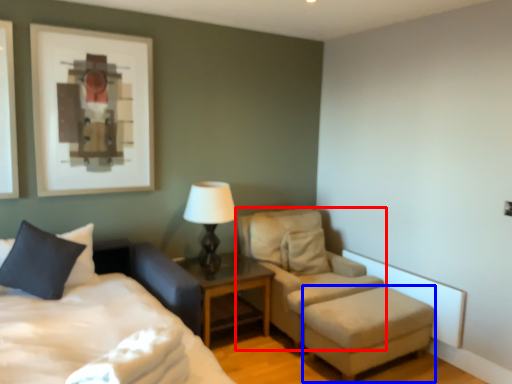
Question: Which point is further to the camera, chair (highlighted by a red box) or stool (highlighted by a blue box)?

Choices:
 (A) chair
 (B) stool

Answer: (A)